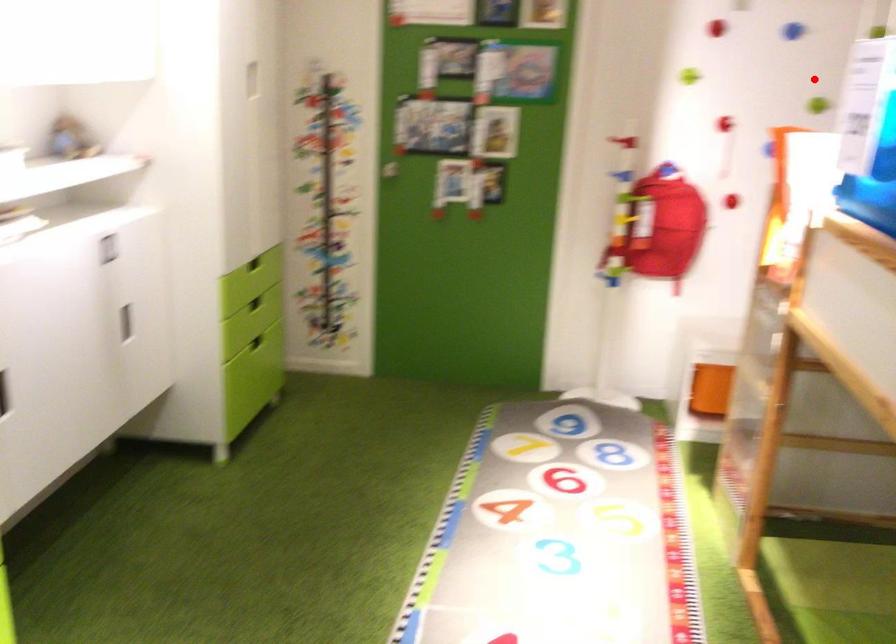
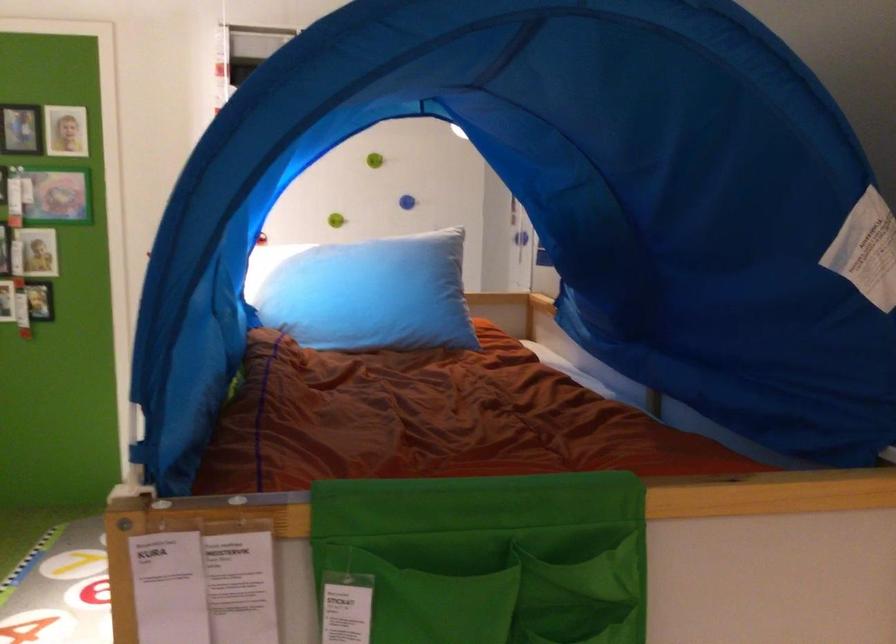
Question: I am providing you with two images of the same scene from different viewpoints. A red point is shown in image1. For the corresponding object point in image2, is it positioned nearer or farther from the camera?

Choices:
 (A) Nearer
 (B) Farther

Answer: (B)